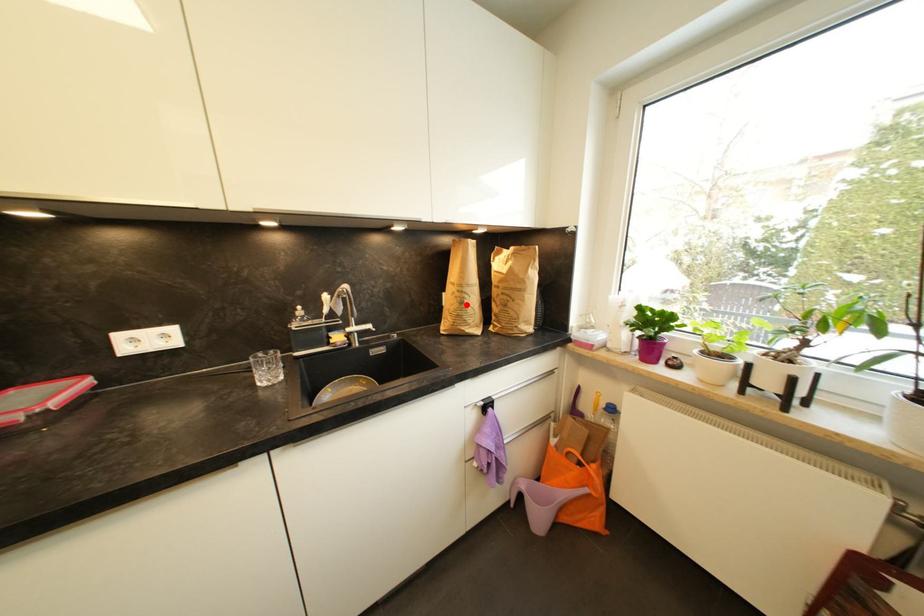
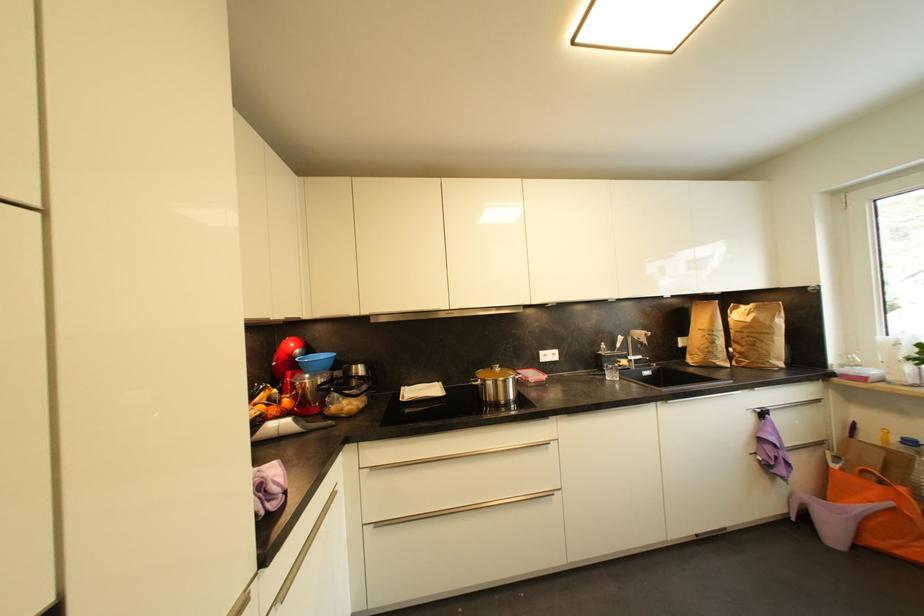
Where in the second image is the point corresponding to the highlighted location from the first image?

(718, 345)